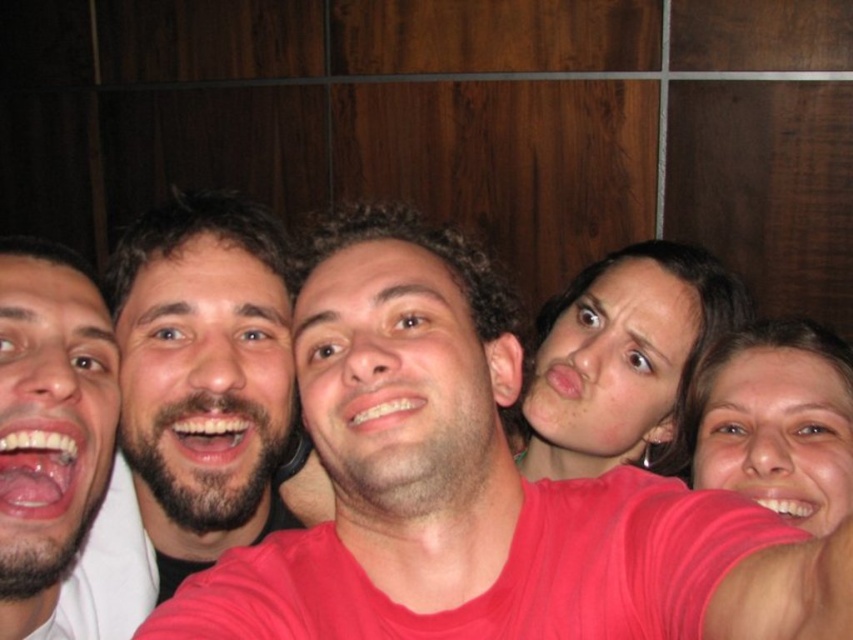
Question: Which object is closer to the camera taking this photo?

Choices:
 (A) smooth skin face at center
 (B) pink fabric shirt at center

Answer: (B)

Question: Is pink fabric shirt at center smaller than smooth skin face at center?

Choices:
 (A) yes
 (B) no

Answer: (B)

Question: Which of the following is the farthest from the observer?

Choices:
 (A) (631, 314)
 (B) (808, 625)

Answer: (A)

Question: Which of the following is the farthest from the observer?

Choices:
 (A) (642, 403)
 (B) (461, 448)

Answer: (A)

Question: Can you confirm if pink fabric shirt at center is positioned to the right of smooth skin face at center?

Choices:
 (A) no
 (B) yes

Answer: (A)

Question: Can you confirm if pink fabric shirt at center is positioned to the right of smooth skin face at center?

Choices:
 (A) yes
 (B) no

Answer: (B)